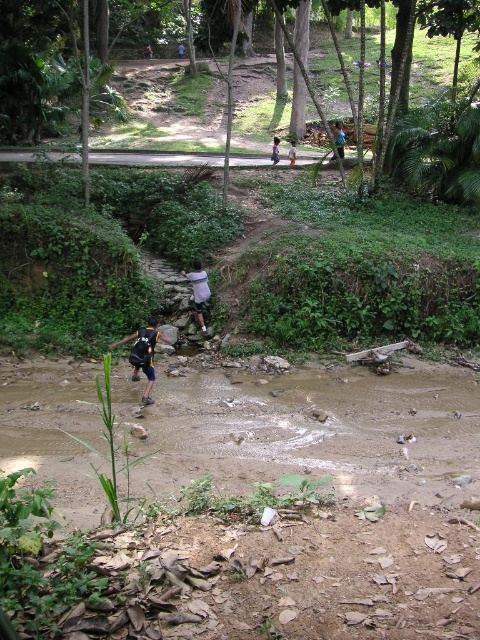
Question: Is brown muddy stream at lower center closer to camera compared to orange fabric shorts at center?

Choices:
 (A) yes
 (B) no

Answer: (A)

Question: Where is dark blue jersey at center located in relation to brown fabric shirt at center in the image?

Choices:
 (A) below
 (B) above

Answer: (A)

Question: Considering the real-world distances, which object is farthest from the brown muddy stream at lower center?

Choices:
 (A) orange fabric shorts at center
 (B) dark blue jersey at center
 (C) white matte shirt at center
 (D) blue fabric shirt at center

Answer: (D)

Question: Estimate the real-world distances between objects in this image. Which object is closer to the orange fabric shorts at center?

Choices:
 (A) white matte shirt at center
 (B) blue fabric shirt at center

Answer: (B)

Question: Does blue fabric shirt at center appear on the right side of brown fabric shirt at center?

Choices:
 (A) no
 (B) yes

Answer: (B)

Question: Which point is farther to the camera?

Choices:
 (A) blue fabric shirt at center
 (B) dark blue jersey at center

Answer: (A)